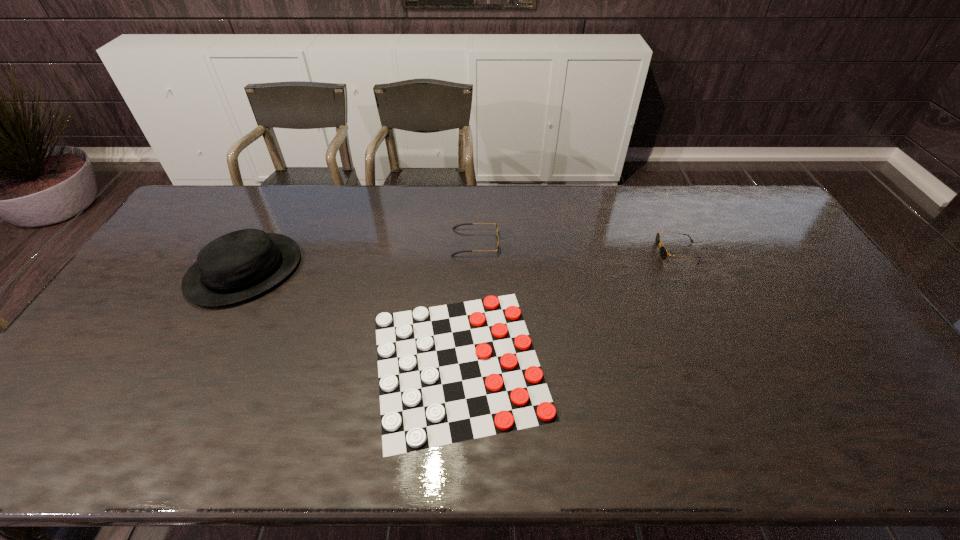
The image size is (960, 540). I want to click on free spot located 0.340m on the right of the checkerboard, so click(684, 363).

Find the location of a particular element. This screenshot has width=960, height=540. object that is positioned at the near edge is located at coordinates (450, 373).

Find the location of a particular element. Image resolution: width=960 pixels, height=540 pixels. object that is at the left edge is located at coordinates (240, 265).

In order to click on vacant point at the far edge in this screenshot , I will do `click(454, 188)`.

Find the location of a particular element. free point at the left edge is located at coordinates [x=168, y=271].

Identify the location of vacant region at the right edge of the desktop. This screenshot has height=540, width=960. (765, 242).

Where is `vacant region between the left sunglasses and the rightmost object`? The height and width of the screenshot is (540, 960). vacant region between the left sunglasses and the rightmost object is located at coordinates (x=576, y=247).

The image size is (960, 540). In order to click on empty space that is in between the checkerboard and the leftmost object in this screenshot , I will do `click(351, 317)`.

In order to click on vacant region between the left sunglasses and the leftmost object in this screenshot , I will do `click(360, 256)`.

Identify the location of free spot between the fedora and the right sunglasses. This screenshot has height=540, width=960. (461, 261).